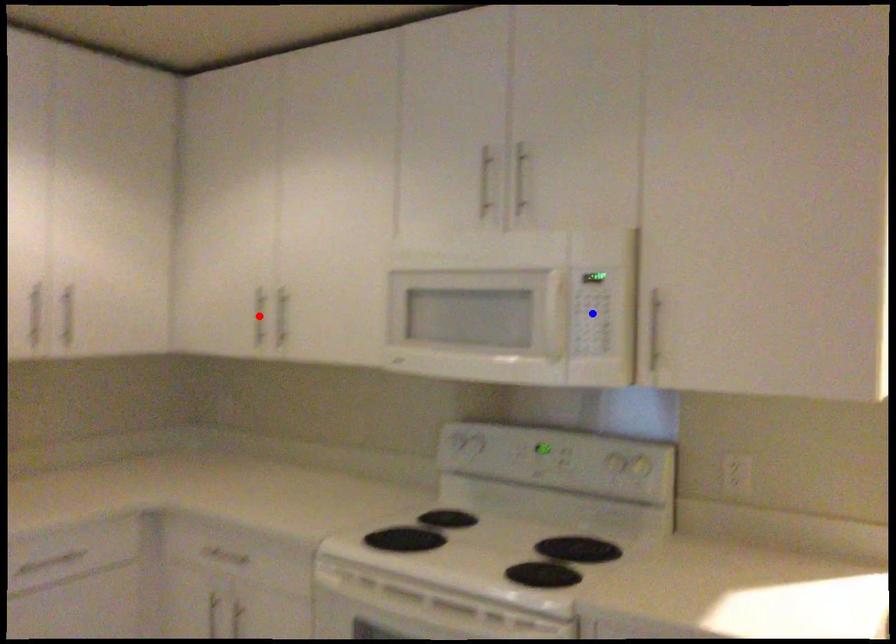
Question: In the image, two points are highlighted. Which point is nearer to the camera? Reply with the corresponding letter.

Choices:
 (A) blue point
 (B) red point

Answer: (A)